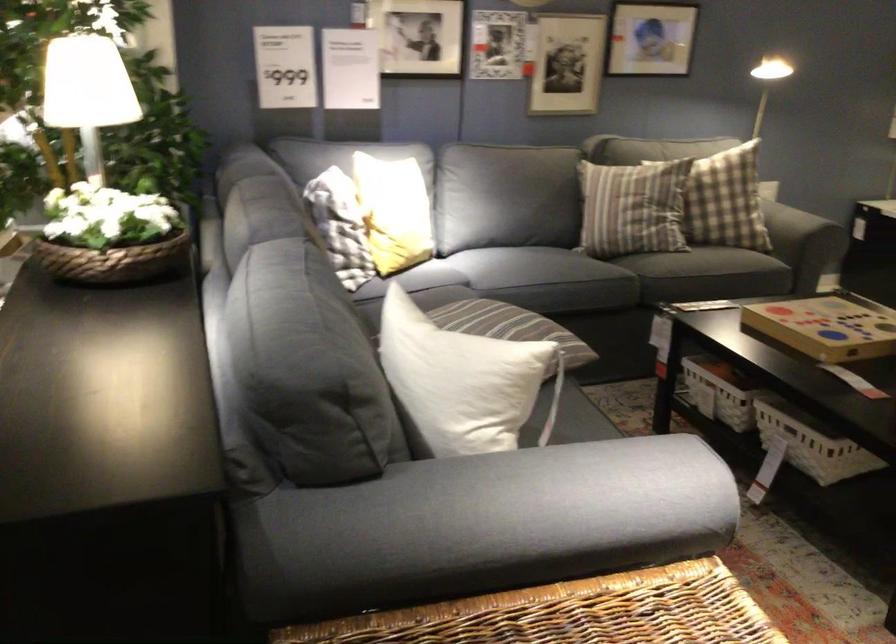
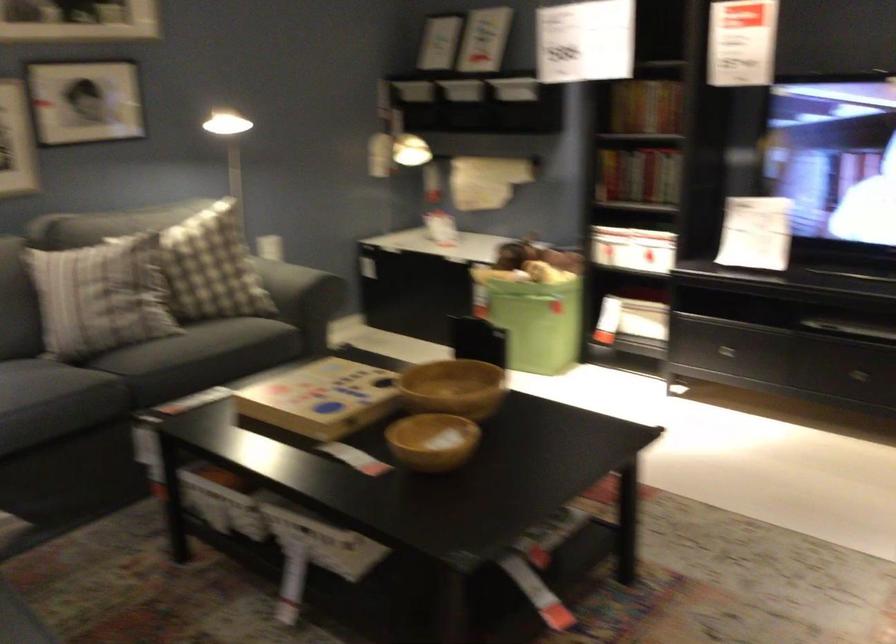
In the second image, find the point that corresponds to (751,187) in the first image.

(211, 267)